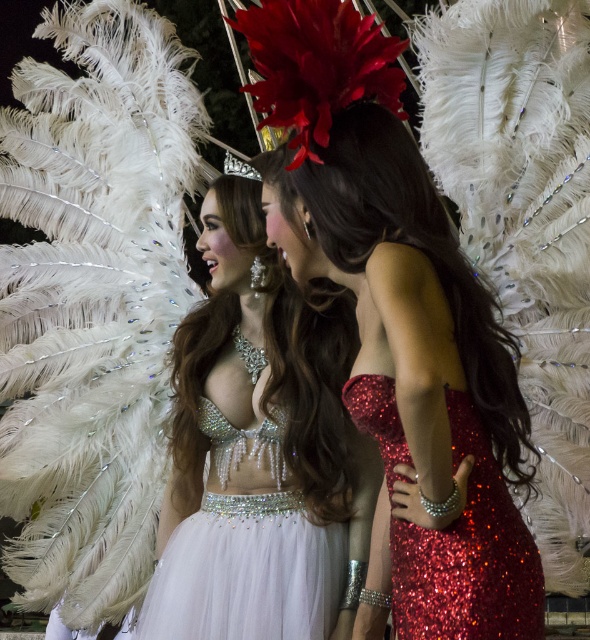
You are a photographer at a fashion show. You need to capture a closeup shot of both the swarthy satin dress at center and the sparkly red dress at center. The camera lens has a maximum focus range of 30 inches. Can you fit both dresses in the frame without moving the camera?

The swarthy satin dress at center and the sparkly red dress at center are 35.61 inches apart, which exceeds the camera lens maximum focus range of 30 inches. Therefore, you cannot fit both dresses in the frame without moving the camera.

You are at a costume party and see two people wearing red dresses at the center of the image. The first person is wearing a shiny red dress at center, and the second is wearing a sparkly red dress at center. Which of these two dresses is positioned to the left?

The shiny red dress at center is positioned to the left of the sparkly red dress at center.

You are standing in front of a festive scene with two costumed individuals. You notice the swarthy satin dress at center. Can you determine the exact coordinates of where this dress is positioned in the image?

The swarthy satin dress at center is located at point (258,449).